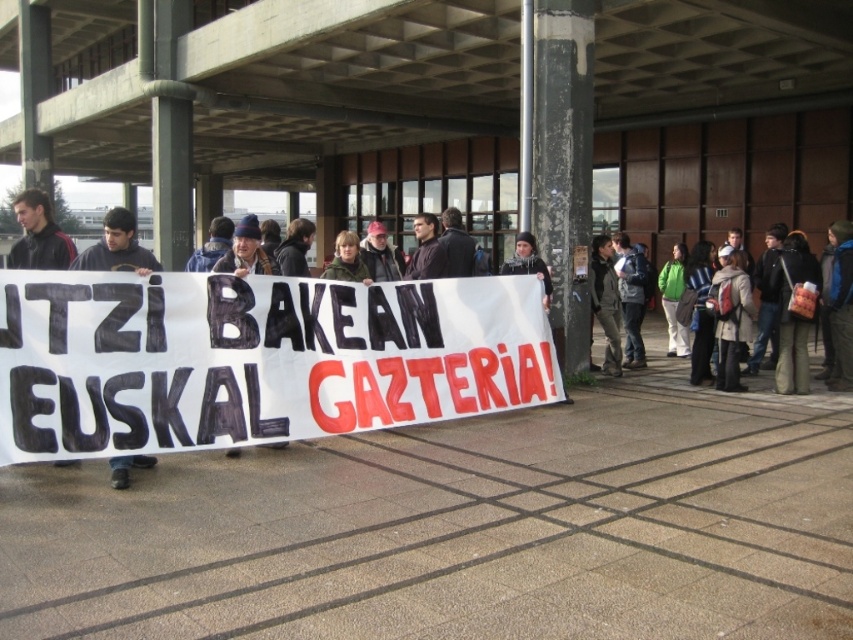
From the picture: Which is below, matte black jacket at left or dark gray knit hat at center?

dark gray knit hat at center is below.

Locate an element on the screen. matte black jacket at left is located at coordinates (38, 234).

Identify the location of matte black jacket at left. (38, 234).

Is dark blue jacket at center to the left of green matte jacket at center from the viewer's perspective?

In fact, dark blue jacket at center is to the right of green matte jacket at center.

Does point (643, 364) come closer to viewer compared to point (358, 246)?

No, (643, 364) is behind (358, 246).

Measure the distance between point (x=635, y=284) and camera.

Point (x=635, y=284) is 37.83 feet away from camera.

Locate an element on the screen. The image size is (853, 640). dark blue jacket at center is located at coordinates (631, 296).

Can you confirm if white woolen hat at center is shorter than green matte jacket at center?

Yes.

Between point (753, 314) and point (358, 241), which one is positioned in front?

Point (358, 241) is more forward.

I want to click on white woolen hat at center, so click(730, 317).